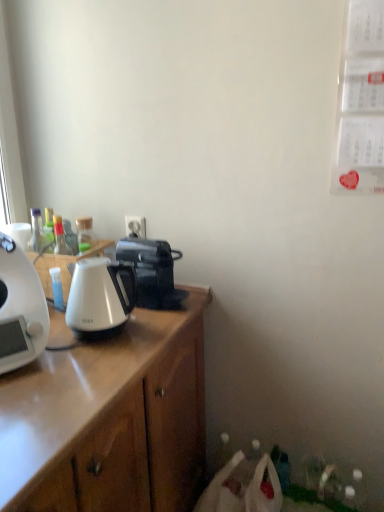
Question: From the image's perspective, would you say white glossy kettle at left is shown under white glossy kettle at left?

Choices:
 (A) no
 (B) yes

Answer: (B)

Question: Is white glossy kettle at left aimed at white glossy kettle at left?

Choices:
 (A) yes
 (B) no

Answer: (B)

Question: Is white glossy kettle at left positioned with its back to white glossy kettle at left?

Choices:
 (A) yes
 (B) no

Answer: (A)

Question: Is white glossy kettle at left to the left of white glossy kettle at left from the viewer's perspective?

Choices:
 (A) yes
 (B) no

Answer: (B)

Question: Is white glossy kettle at left wider than white glossy kettle at left?

Choices:
 (A) no
 (B) yes

Answer: (A)

Question: Is white plastic power outlet at center in front of or behind white glossy kettle at left in the image?

Choices:
 (A) front
 (B) behind

Answer: (B)

Question: In terms of width, does white plastic power outlet at center look wider or thinner when compared to white glossy kettle at left?

Choices:
 (A) thin
 (B) wide

Answer: (A)

Question: From the image's perspective, is white plastic power outlet at center located above or below white glossy kettle at left?

Choices:
 (A) below
 (B) above

Answer: (B)

Question: Is white plastic power outlet at center to the left or to the right of white glossy kettle at left in the image?

Choices:
 (A) right
 (B) left

Answer: (A)

Question: From the image's perspective, is white glossy kettle at left above or below white glossy kettle at left?

Choices:
 (A) below
 (B) above

Answer: (B)

Question: In terms of width, does white glossy kettle at left look wider or thinner when compared to white glossy kettle at left?

Choices:
 (A) wide
 (B) thin

Answer: (A)

Question: Is white glossy kettle at left inside the boundaries of white glossy kettle at left, or outside?

Choices:
 (A) inside
 (B) outside

Answer: (B)

Question: Visually, is white glossy kettle at left positioned to the left or to the right of white glossy kettle at left?

Choices:
 (A) left
 (B) right

Answer: (A)

Question: From a real-world perspective, relative to white glossy kettle at left, is black plastic coffee maker at upper center, the second coffee maker in the front-to-back sequence, vertically above or below?

Choices:
 (A) above
 (B) below

Answer: (B)

Question: From their relative heights in the image, would you say black plastic coffee maker at upper center, the 1th coffee maker in the right-to-left sequence, is taller or shorter than white glossy kettle at left?

Choices:
 (A) short
 (B) tall

Answer: (A)